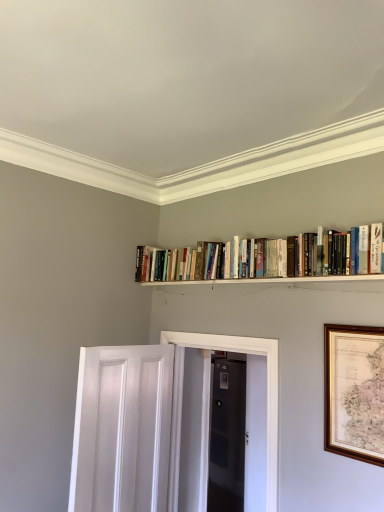
Measure the distance between white wooden shelf at upper center and camera.

1.69 meters.

Describe the element at coordinates (277, 282) in the screenshot. I see `white wooden shelf at upper center` at that location.

Describe the element at coordinates (354, 392) in the screenshot. I see `wooden framed map at right` at that location.

Locate an element on the screen. The width and height of the screenshot is (384, 512). wooden framed map at right is located at coordinates (354, 392).

This screenshot has width=384, height=512. What do you see at coordinates (122, 429) in the screenshot? I see `white painted wood door at lower left, which is counted as the first door, starting from the front` at bounding box center [122, 429].

Image resolution: width=384 pixels, height=512 pixels. I want to click on white painted wood door at lower left, which is counted as the first door, starting from the front, so click(122, 429).

What do you see at coordinates (267, 395) in the screenshot?
I see `white glossy elevator at center` at bounding box center [267, 395].

Image resolution: width=384 pixels, height=512 pixels. What are the coordinates of `black glossy door at center, the 2th door positioned from the left` in the screenshot? It's located at (227, 437).

From a real-world perspective, which object stands above the other?

wooden framed map at right.

Considering the points (96, 463) and (361, 387), which point is behind, point (96, 463) or point (361, 387)?

The point (96, 463) is behind.

Could you measure the distance between white painted wood door at lower left, which is counted as the 2th door, starting from the right, and wooden framed map at right?

white painted wood door at lower left, which is counted as the 2th door, starting from the right, and wooden framed map at right are 3.67 feet apart from each other.

The height and width of the screenshot is (512, 384). I want to click on the 2nd door counting from the left of the wooden framed map at right, so click(x=122, y=429).

Between wooden framed map at right and white painted wood door at lower left, which is counted as the 2th door, starting from the right, which one has less height?

Standing shorter between the two is wooden framed map at right.

Is wooden framed map at right to the right of white painted wood door at lower left, which is counted as the first door, starting from the front, from the viewer's perspective?

Yes.

Is point (354, 426) positioned before point (99, 412)?

That is True.

Does wooden framed map at right touch white glossy elevator at center?

wooden framed map at right and white glossy elevator at center are clearly separated.

Consider the image. Considering the relative sizes of wooden framed map at right and white glossy elevator at center in the image provided, is wooden framed map at right taller than white glossy elevator at center?

No, wooden framed map at right is not taller than white glossy elevator at center.

Can you confirm if wooden framed map at right is wider than white glossy elevator at center?

Incorrect, the width of wooden framed map at right does not surpass that of white glossy elevator at center.

Is point (326, 372) positioned after point (78, 398)?

That is False.

From the image's perspective, which one is positioned lower, white wooden shelf at upper center or black glossy door at center, the first door in the right-to-left sequence?

black glossy door at center, the first door in the right-to-left sequence.

How different are the orientations of white wooden shelf at upper center and black glossy door at center, which is the first door from back to front, in degrees?

The facing directions of white wooden shelf at upper center and black glossy door at center, which is the first door from back to front, are 0.0864 degrees apart.

Between white wooden shelf at upper center and black glossy door at center, the 2th door positioned from the left, which one has larger size?

With larger size is black glossy door at center, the 2th door positioned from the left.

What are the coordinates of `shelf in front of the black glossy door at center, which is counted as the 2th door, starting from the front` in the screenshot? It's located at (277, 282).

Between white painted wood door at lower left, which is counted as the 2th door, starting from the right, and white wooden shelf at upper center, which one has larger width?

Wider between the two is white painted wood door at lower left, which is counted as the 2th door, starting from the right.

From the image's perspective, between white painted wood door at lower left, which is counted as the first door, starting from the front, and white wooden shelf at upper center, which one is located above?

white wooden shelf at upper center, from the image's perspective.

Could you tell me if white painted wood door at lower left, placed as the 2th door when sorted from back to front, is facing white wooden shelf at upper center?

No, white painted wood door at lower left, placed as the 2th door when sorted from back to front, is not facing towards white wooden shelf at upper center.

From a real-world perspective, is white painted wood door at lower left, placed as the 1th door when sorted from left to right, above or below white wooden shelf at upper center?

white painted wood door at lower left, placed as the 1th door when sorted from left to right, is situated lower than white wooden shelf at upper center in the real world.

From the image's perspective, is white painted wood door at lower left, placed as the 1th door when sorted from left to right, located above black glossy door at center, which is counted as the 2th door, starting from the front?

Yes, from the image's perspective, white painted wood door at lower left, placed as the 1th door when sorted from left to right, is on top of black glossy door at center, which is counted as the 2th door, starting from the front.

Identify the location of door beneath the white painted wood door at lower left, placed as the 2th door when sorted from back to front (from a real-world perspective). The width and height of the screenshot is (384, 512). (227, 437).

In the image, is white painted wood door at lower left, which is counted as the first door, starting from the front, positioned in front of or behind black glossy door at center, the 2th door positioned from the left?

In the image, white painted wood door at lower left, which is counted as the first door, starting from the front, appears in front of black glossy door at center, the 2th door positioned from the left.

Is point (90, 385) more distant than point (225, 467)?

No, it is in front of (225, 467).

Does white wooden shelf at upper center have a lesser width compared to white painted wood door at lower left, which is counted as the first door, starting from the front?

Correct, the width of white wooden shelf at upper center is less than that of white painted wood door at lower left, which is counted as the first door, starting from the front.

Is white wooden shelf at upper center aimed at white painted wood door at lower left, placed as the 1th door when sorted from left to right?

No, white wooden shelf at upper center is not oriented towards white painted wood door at lower left, placed as the 1th door when sorted from left to right.

In the image, there is a white painted wood door at lower left, placed as the 2th door when sorted from back to front. Identify the location of picture frame above it (from the image's perspective). The image size is (384, 512). (354, 392).

There is a wooden framed map at right. Where is `the 1st door below it (from a real-world perspective)`? Image resolution: width=384 pixels, height=512 pixels. the 1st door below it (from a real-world perspective) is located at coordinates (122, 429).

Looking at the image, which one is located closer to white wooden shelf at upper center, white painted wood door at lower left, placed as the 2th door when sorted from back to front, or wooden framed map at right?

wooden framed map at right.

Estimate the real-world distances between objects in this image. Which object is further from white painted wood door at lower left, placed as the 2th door when sorted from back to front, white wooden shelf at upper center or black glossy door at center, which is counted as the 2th door, starting from the front?

black glossy door at center, which is counted as the 2th door, starting from the front, lies further to white painted wood door at lower left, placed as the 2th door when sorted from back to front, than the other object.

Looking at the image, which one is located further to wooden framed map at right, black glossy door at center, the 2th door positioned from the left, or white wooden shelf at upper center?

black glossy door at center, the 2th door positioned from the left.

In the scene shown: Considering their positions, is white painted wood door at lower left, placed as the 2th door when sorted from back to front, positioned closer to wooden framed map at right than black glossy door at center, the 2th door positioned from the left?

white painted wood door at lower left, placed as the 2th door when sorted from back to front.

Based on their spatial positions, is wooden framed map at right or white wooden shelf at upper center further from black glossy door at center, the 2th door positioned from the left?

Based on the image, wooden framed map at right appears to be further to black glossy door at center, the 2th door positioned from the left.

Consider the image. From the image, which object appears to be farther from wooden framed map at right, white painted wood door at lower left, placed as the 1th door when sorted from left to right, or white wooden shelf at upper center?

white painted wood door at lower left, placed as the 1th door when sorted from left to right, is positioned further to the anchor wooden framed map at right.

Estimate the real-world distances between objects in this image. Which object is closer to wooden framed map at right, white glossy elevator at center or white painted wood door at lower left, placed as the 1th door when sorted from left to right?

white glossy elevator at center lies closer to wooden framed map at right than the other object.

Estimate the real-world distances between objects in this image. Which object is further from white painted wood door at lower left, which is counted as the first door, starting from the front, black glossy door at center, the first door in the right-to-left sequence, or white wooden shelf at upper center?

black glossy door at center, the first door in the right-to-left sequence.

The image size is (384, 512). What are the coordinates of `elevator between white wooden shelf at upper center and black glossy door at center, the first door in the right-to-left sequence, in the front-back direction` in the screenshot? It's located at (267, 395).

This screenshot has height=512, width=384. I want to click on elevator situated between white painted wood door at lower left, which is counted as the 2th door, starting from the right, and wooden framed map at right from left to right, so click(267, 395).

Where is `elevator positioned between white painted wood door at lower left, placed as the 2th door when sorted from back to front, and black glossy door at center, the first door in the right-to-left sequence, from near to far`? This screenshot has width=384, height=512. elevator positioned between white painted wood door at lower left, placed as the 2th door when sorted from back to front, and black glossy door at center, the first door in the right-to-left sequence, from near to far is located at coordinates (267, 395).

Image resolution: width=384 pixels, height=512 pixels. In order to click on elevator positioned between wooden framed map at right and black glossy door at center, the first door in the right-to-left sequence, from near to far in this screenshot , I will do `click(267, 395)`.